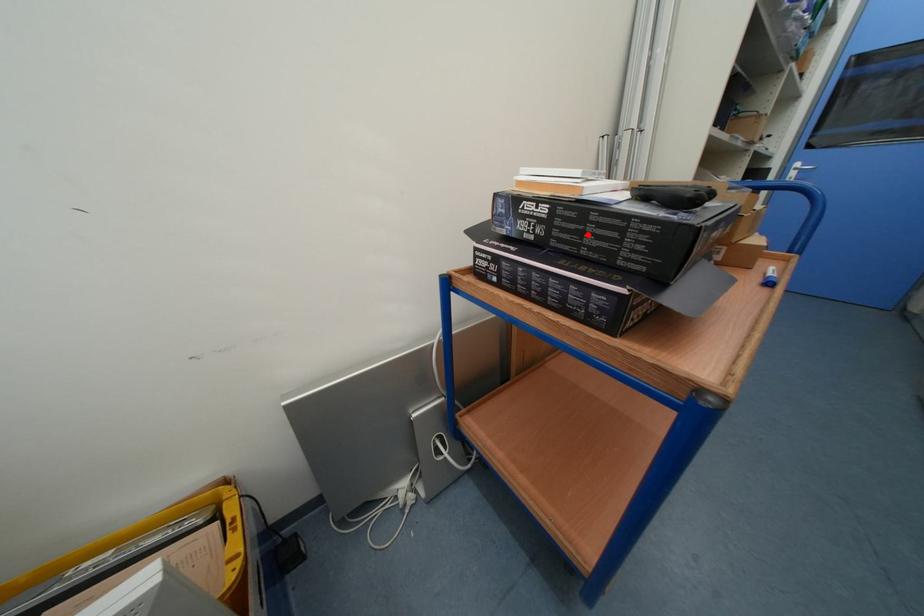
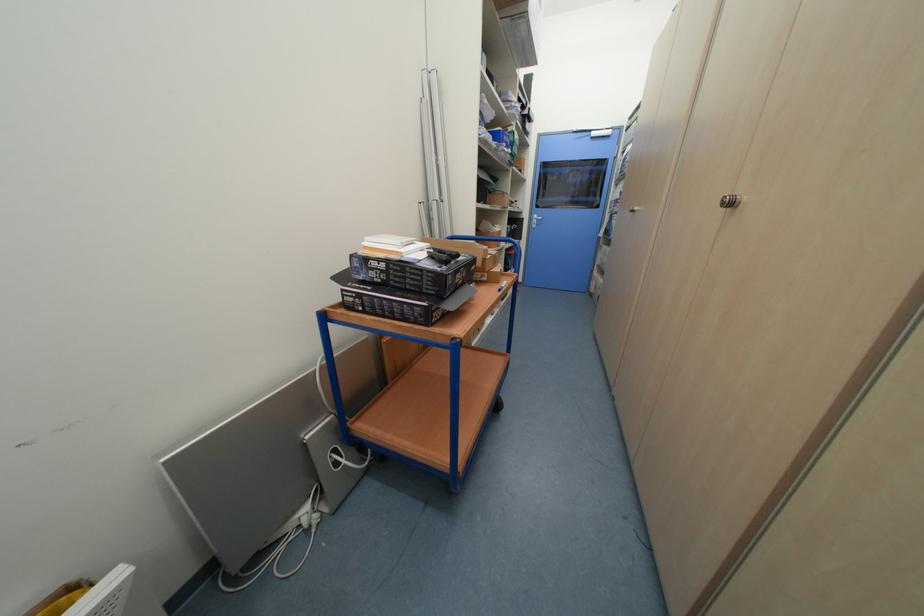
In the second image, find the point that corresponds to the highlighted location in the first image.

(410, 278)